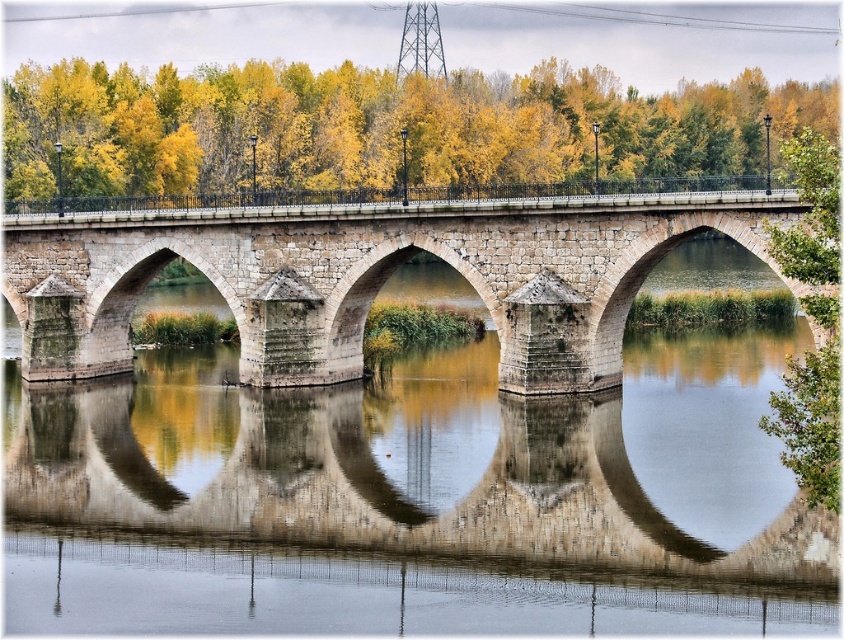
Question: From the image, what is the correct spatial relationship of stone bridge at center in relation to green leafy tree at right?

Choices:
 (A) above
 (B) below

Answer: (B)

Question: Which of the following is the closest to the observer?

Choices:
 (A) (222, 268)
 (B) (810, 356)
 (C) (450, 132)
 (D) (273, 412)

Answer: (B)

Question: Which of these objects is positioned farthest from the smooth stone water at center?

Choices:
 (A) stone bridge at center
 (B) green leafy tree at right
 (C) yellow leaves at center

Answer: (C)

Question: Observing the image, what is the correct spatial positioning of smooth stone water at center in reference to green leafy tree at right?

Choices:
 (A) below
 (B) above

Answer: (A)

Question: Is smooth stone water at center above stone bridge at center?

Choices:
 (A) yes
 (B) no

Answer: (B)

Question: Which of the following is the farthest from the observer?

Choices:
 (A) (419, 81)
 (B) (576, 525)

Answer: (A)